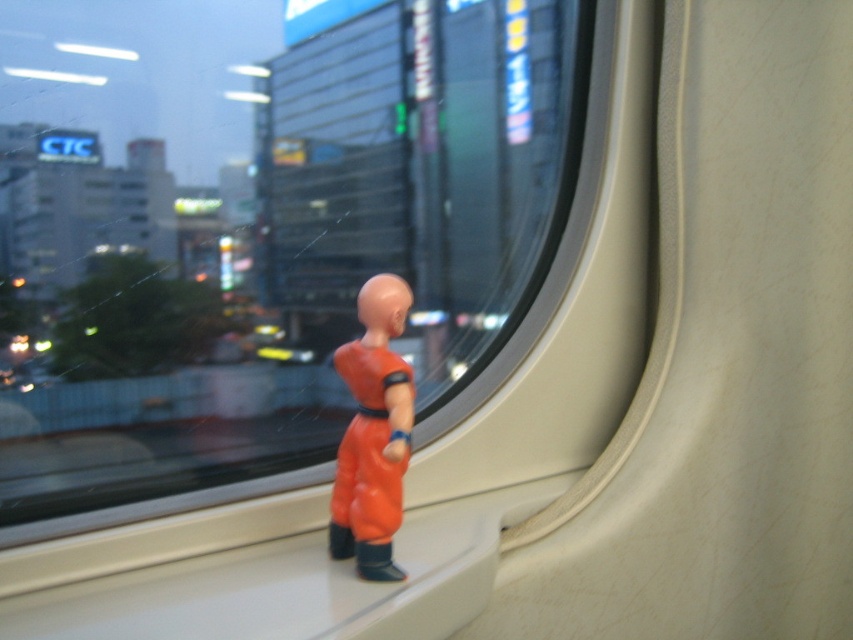
Question: Can you confirm if transparent plastic train window at center is positioned to the right of orange matte figure at center?

Choices:
 (A) no
 (B) yes

Answer: (A)

Question: Is transparent plastic train window at center thinner than orange matte figure at center?

Choices:
 (A) yes
 (B) no

Answer: (B)

Question: Is transparent plastic train window at center further to the viewer compared to orange matte figure at center?

Choices:
 (A) no
 (B) yes

Answer: (B)

Question: Which object is farther from the camera taking this photo?

Choices:
 (A) orange matte figure at center
 (B) transparent plastic train window at center

Answer: (B)

Question: Which of the following is the closest to the observer?

Choices:
 (A) (299, 250)
 (B) (340, 365)

Answer: (B)